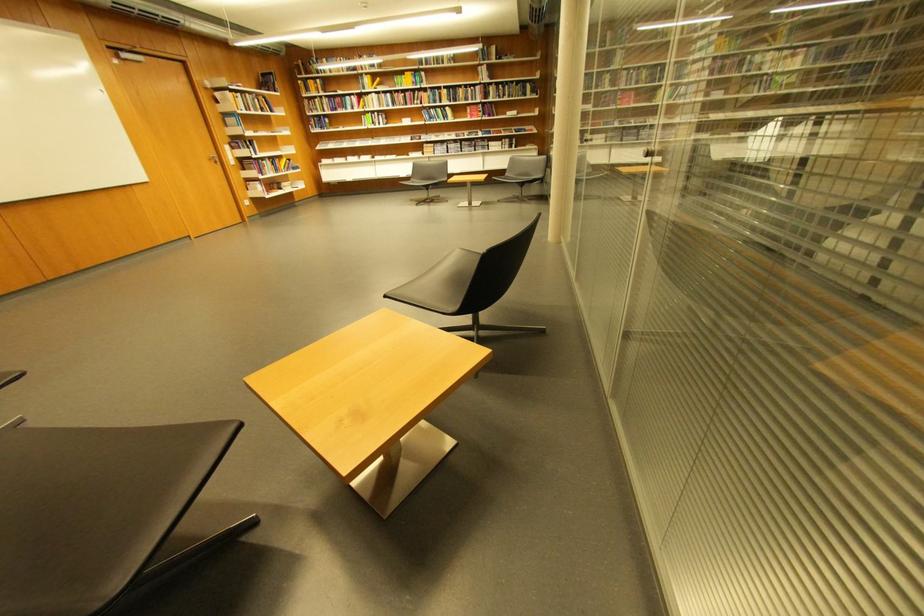
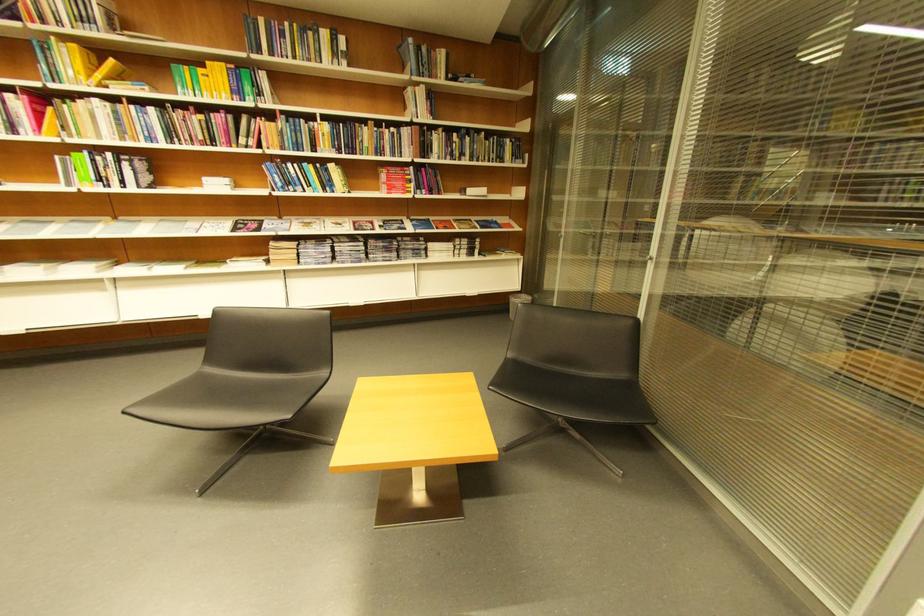
Locate, in the second image, the point that corresponds to (428,106) in the first image.

(258, 148)